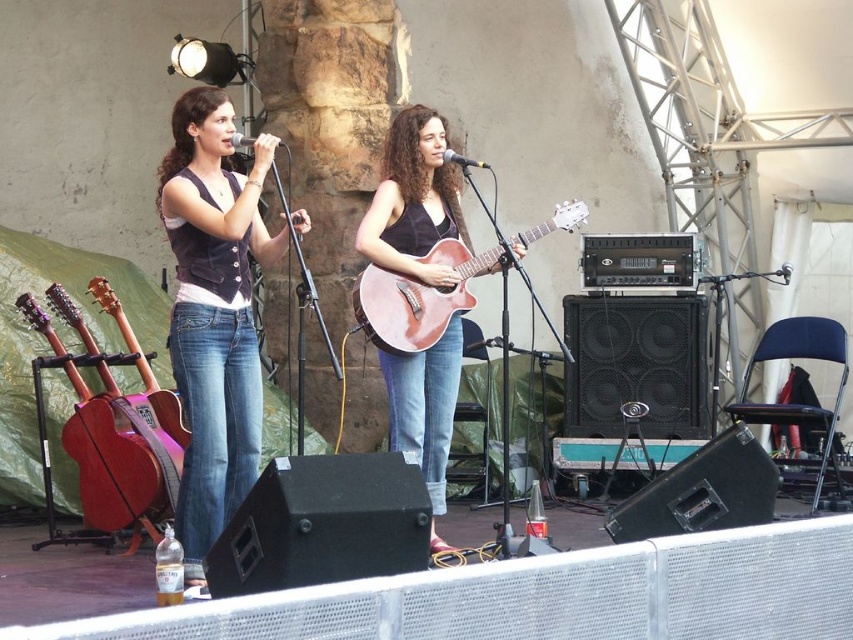
Question: Observing the image, what is the correct spatial positioning of denim jeans at center in reference to matte brown acoustic guitar at left?

Choices:
 (A) above
 (B) below

Answer: (A)

Question: Which object is the closest to the wooden acoustic guitar at center?

Choices:
 (A) matte brown acoustic guitar at left
 (B) matte brown guitar at center
 (C) denim jeans at center

Answer: (B)

Question: Is denim jeans at center positioned behind wooden acoustic guitar at center?

Choices:
 (A) no
 (B) yes

Answer: (A)

Question: Which point appears closest to the camera in this image?

Choices:
 (A) (418, 392)
 (B) (195, 192)
 (C) (70, 310)

Answer: (B)

Question: Considering the real-world distances, which object is farthest from the matte brown guitar at center?

Choices:
 (A) wooden acoustic guitar at center
 (B) denim jeans at center
 (C) matte brown acoustic guitar at left

Answer: (C)

Question: Is matte brown guitar at center to the left of wooden acoustic guitar at center from the viewer's perspective?

Choices:
 (A) yes
 (B) no

Answer: (A)